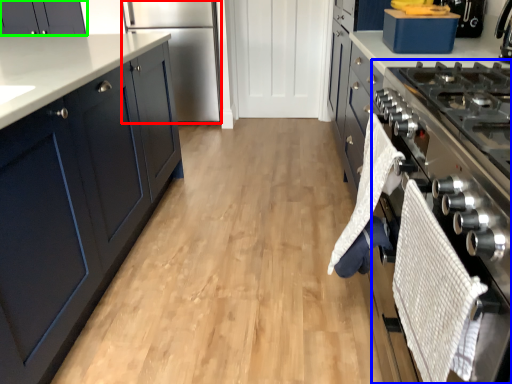
Question: Which object is the farthest from refrigerator (highlighted by a red box)? Choose among these: oven (highlighted by a blue box) or cabinetry (highlighted by a green box).

Choices:
 (A) oven
 (B) cabinetry

Answer: (A)